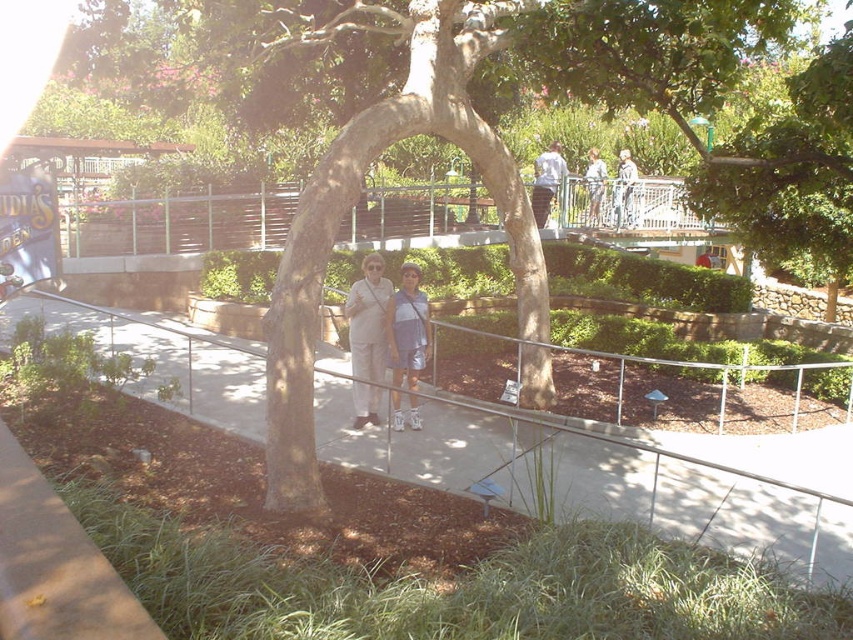
Looking at this image, you are a photographer aiming to capture a clear shot of the light blue denim shorts at center without the light beige pants at center blocking it. Based on their positions, is this possible?

The light beige pants at center is positioned under light blue denim shorts at center, so the light beige pants at center would block the view of the light blue denim shorts at center. Therefore, capturing a clear shot without obstruction might not be possible.